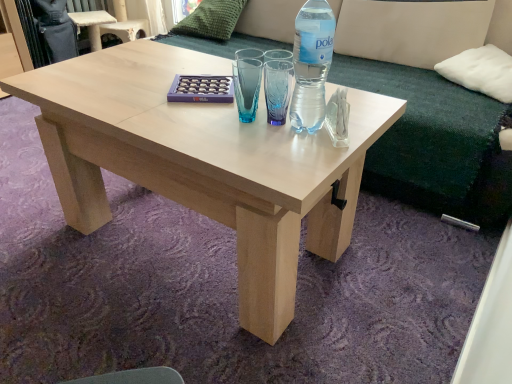
Question: Does natural wood coffee table at center have a lesser width compared to green textured pillow at upper center, the second pillow positioned from the front?

Choices:
 (A) no
 (B) yes

Answer: (A)

Question: Considering the relative sizes of natural wood coffee table at center and green textured pillow at upper center, acting as the 1th pillow starting from the left, in the image provided, is natural wood coffee table at center smaller than green textured pillow at upper center, acting as the 1th pillow starting from the left,?

Choices:
 (A) yes
 (B) no

Answer: (B)

Question: Is natural wood coffee table at center positioned far away from green textured pillow at upper center, the second pillow positioned from the front?

Choices:
 (A) no
 (B) yes

Answer: (B)

Question: From a real-world perspective, is natural wood coffee table at center positioned under green textured pillow at upper center, the 1th pillow positioned from the back, based on gravity?

Choices:
 (A) no
 (B) yes

Answer: (B)

Question: Are natural wood coffee table at center and green textured pillow at upper center, the 2th pillow in the bottom-to-top sequence, beside each other?

Choices:
 (A) yes
 (B) no

Answer: (B)

Question: Does point (396, 92) appear closer or farther from the camera than point (174, 155)?

Choices:
 (A) farther
 (B) closer

Answer: (A)

Question: From their relative heights in the image, would you say beige fabric couch at upper center is taller or shorter than natural wood coffee table at center?

Choices:
 (A) short
 (B) tall

Answer: (B)

Question: Based on their positions, is beige fabric couch at upper center located to the left or right of natural wood coffee table at center?

Choices:
 (A) left
 (B) right

Answer: (B)

Question: Is beige fabric couch at upper center wider or thinner than natural wood coffee table at center?

Choices:
 (A) wide
 (B) thin

Answer: (B)

Question: Looking at the image, does green textured pillow at upper center, the second pillow positioned from the front, seem bigger or smaller compared to clear plastic bottle at center?

Choices:
 (A) big
 (B) small

Answer: (A)

Question: Considering the positions of green textured pillow at upper center, the 1th pillow in the top-to-bottom sequence, and clear plastic bottle at center in the image, is green textured pillow at upper center, the 1th pillow in the top-to-bottom sequence, wider or thinner than clear plastic bottle at center?

Choices:
 (A) wide
 (B) thin

Answer: (A)

Question: From the image's perspective, is green textured pillow at upper center, arranged as the second pillow when viewed from the right, positioned above or below clear plastic bottle at center?

Choices:
 (A) above
 (B) below

Answer: (A)

Question: Is green textured pillow at upper center, the 1th pillow in the top-to-bottom sequence, in front of or behind clear plastic bottle at center in the image?

Choices:
 (A) front
 (B) behind

Answer: (B)

Question: Considering the positions of beige fabric couch at upper center and clear plastic bottle at center in the image, is beige fabric couch at upper center taller or shorter than clear plastic bottle at center?

Choices:
 (A) tall
 (B) short

Answer: (A)

Question: Is beige fabric couch at upper center in front of or behind clear plastic bottle at center in the image?

Choices:
 (A) behind
 (B) front

Answer: (A)